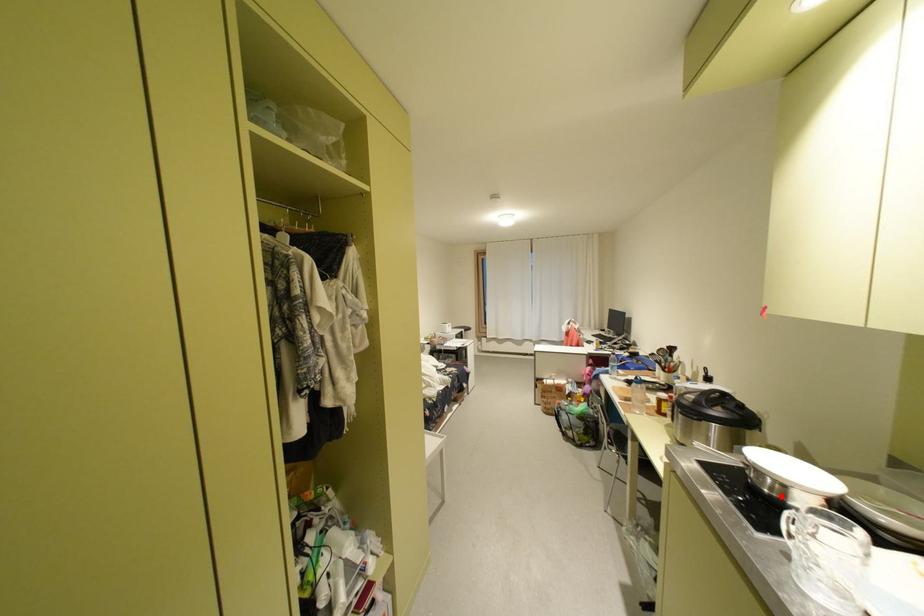
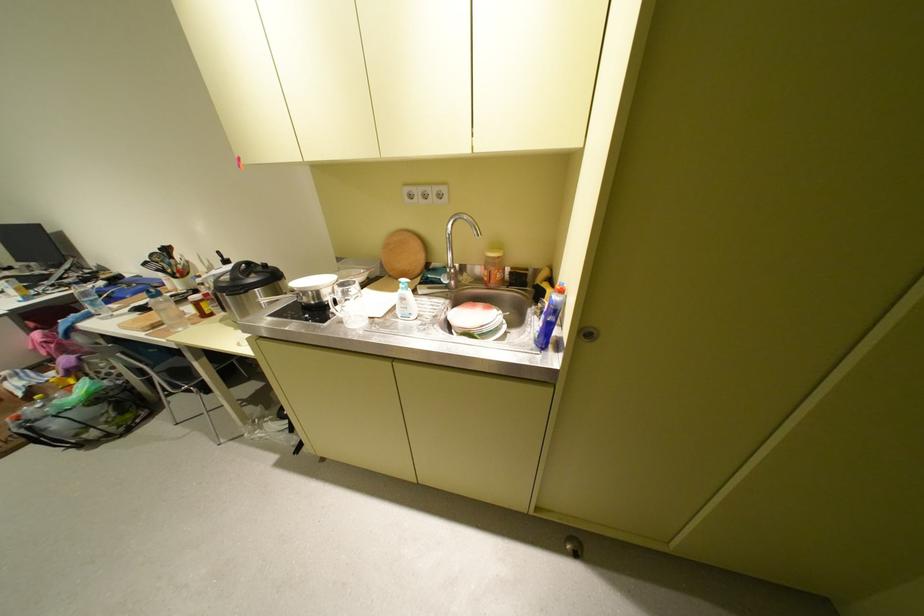
In the second image, find the point that corresponds to the highlighted location in the first image.

(326, 304)